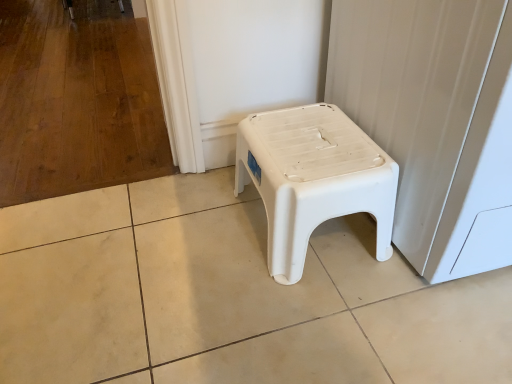
Locate an element on the screen. The image size is (512, 384). white plastic stool at lower right is located at coordinates (426, 109).

What do you see at coordinates (426, 109) in the screenshot? I see `white plastic stool at lower right` at bounding box center [426, 109].

What do you see at coordinates (313, 179) in the screenshot? I see `white plastic stool at center` at bounding box center [313, 179].

The height and width of the screenshot is (384, 512). In order to click on white plastic stool at center in this screenshot , I will do `click(313, 179)`.

What is the approximate height of white plastic stool at center?

9.86 inches.

Locate an element on the screen. The height and width of the screenshot is (384, 512). white plastic stool at lower right is located at coordinates (426, 109).

Does white plastic stool at center appear on the right side of white plastic stool at lower right?

Incorrect, white plastic stool at center is not on the right side of white plastic stool at lower right.

Considering the positions of objects white plastic stool at center and white plastic stool at lower right in the image provided, who is in front, white plastic stool at center or white plastic stool at lower right?

white plastic stool at lower right.

Which point is more forward, (x=361, y=144) or (x=443, y=134)?

Positioned in front is point (x=443, y=134).

From the image's perspective, is white plastic stool at center on white plastic stool at lower right?

Actually, white plastic stool at center appears below white plastic stool at lower right in the image.

From a real-world perspective, is white plastic stool at center below white plastic stool at lower right?

Correct, in the physical world, white plastic stool at center is lower than white plastic stool at lower right.

Considering the relative sizes of white plastic stool at center and white plastic stool at lower right in the image provided, is white plastic stool at center wider than white plastic stool at lower right?

No, white plastic stool at center is not wider than white plastic stool at lower right.

Is white plastic stool at center taller or shorter than white plastic stool at lower right?

Considering their sizes, white plastic stool at center has less height than white plastic stool at lower right.

Is white plastic stool at center bigger than white plastic stool at lower right?

Incorrect, white plastic stool at center is not larger than white plastic stool at lower right.

Is white plastic stool at lower right completely or partially inside white plastic stool at center?

Definitely not — white plastic stool at lower right is not inside white plastic stool at center.

Is the surface of white plastic stool at center in direct contact with white plastic stool at lower right?

white plastic stool at center is not next to white plastic stool at lower right, and they're not touching.

Could you tell me if white plastic stool at center is facing white plastic stool at lower right?

No, white plastic stool at center does not turn towards white plastic stool at lower right.

This screenshot has width=512, height=384. Find the location of `stool behind the white plastic stool at lower right`. stool behind the white plastic stool at lower right is located at coordinates (313, 179).

Which is more to the left, white plastic stool at lower right or white plastic stool at center?

white plastic stool at center is more to the left.

Which is behind, white plastic stool at lower right or white plastic stool at center?

Positioned behind is white plastic stool at center.

Does point (480, 188) appear closer or farther from the camera than point (287, 225)?

Point (480, 188) is closer to the camera than point (287, 225).

From the image's perspective, between white plastic stool at lower right and white plastic stool at center, who is located below?

white plastic stool at center appears lower in the image.

From a real-world perspective, which object rests below the other?

In real-world perspective, white plastic stool at center is lower.

Is white plastic stool at lower right thinner than white plastic stool at center?

Incorrect, the width of white plastic stool at lower right is not less than that of white plastic stool at center.

From the picture: Is white plastic stool at lower right shorter than white plastic stool at center?

In fact, white plastic stool at lower right may be taller than white plastic stool at center.

Considering the sizes of white plastic stool at lower right and white plastic stool at center in the image, is white plastic stool at lower right bigger or smaller than white plastic stool at center?

Clearly, white plastic stool at lower right is larger in size than white plastic stool at center.

In the scene shown: Would you say white plastic stool at lower right contains white plastic stool at center?

Definitely not — white plastic stool at center is not inside white plastic stool at lower right.

Would you consider white plastic stool at lower right to be distant from white plastic stool at center?

No, white plastic stool at lower right is in close proximity to white plastic stool at center.

Based on the photo, is white plastic stool at lower right facing away from white plastic stool at center?

white plastic stool at lower right does not have its back to white plastic stool at center.

How different are the orientations of white plastic stool at lower right and white plastic stool at center in degrees?

The facing directions of white plastic stool at lower right and white plastic stool at center are 0.81 degrees apart.

At what (x,y) coordinates should I click in order to perform the action: click on screen door in front of the white plastic stool at center. Please return your answer as a coordinate pair (x, y). The width and height of the screenshot is (512, 384). Looking at the image, I should click on (426, 109).

I want to click on screen door lying above the white plastic stool at center (from the image's perspective), so click(426, 109).

Where is `stool lying behind the white plastic stool at lower right`? stool lying behind the white plastic stool at lower right is located at coordinates (313, 179).